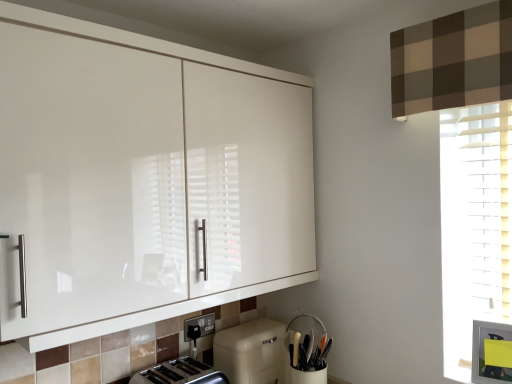
Question: Based on their sizes in the image, would you say silver metallic toaster at lower center is bigger or smaller than black plastic electric outlet at lower center?

Choices:
 (A) small
 (B) big

Answer: (B)

Question: Considering the positions of silver metallic toaster at lower center and black plastic electric outlet at lower center in the image, is silver metallic toaster at lower center taller or shorter than black plastic electric outlet at lower center?

Choices:
 (A) short
 (B) tall

Answer: (B)

Question: Estimate the real-world distances between objects in this image. Which object is farther from the silver metallic toaster at lower center?

Choices:
 (A) white glossy cabinet at upper left
 (B) beige matte dishwasher at lower center
 (C) black plastic electric outlet at lower center
 (D) white matte utensil holder at lower center

Answer: (A)

Question: Which object is positioned closest to the white glossy cabinet at upper left?

Choices:
 (A) white matte utensil holder at lower center
 (B) beige matte dishwasher at lower center
 (C) silver metallic toaster at lower center
 (D) black plastic electric outlet at lower center

Answer: (B)